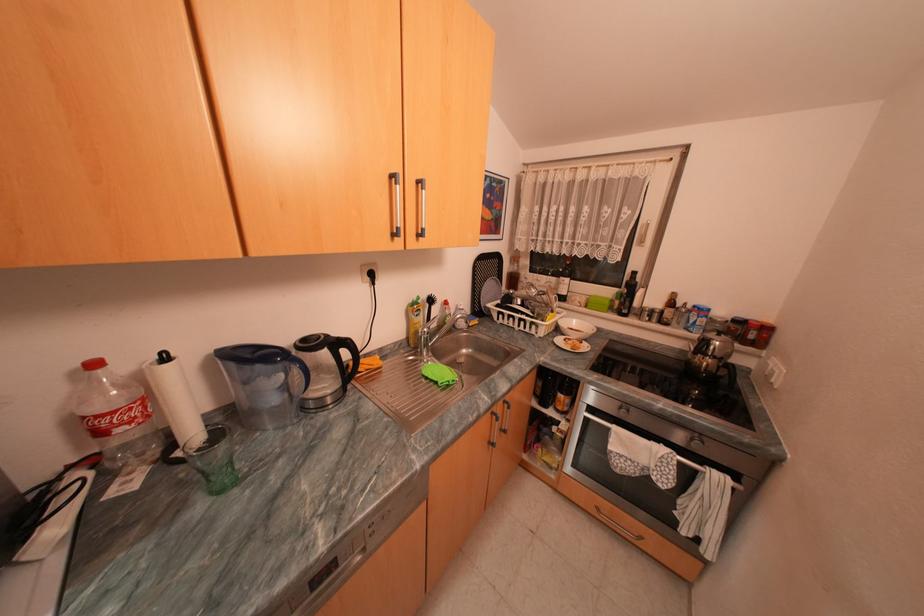
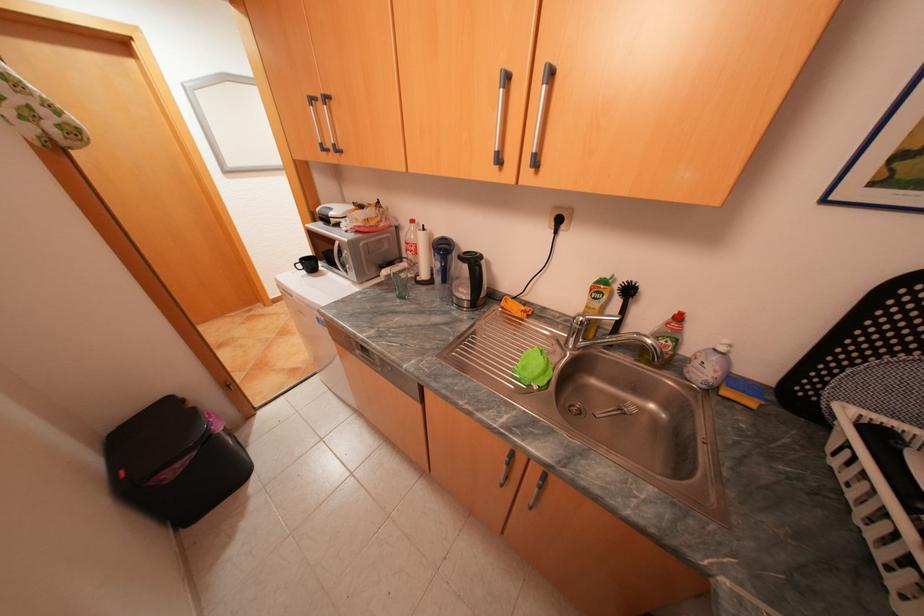
How did the camera likely rotate?

The camera's rotation is toward left-down.